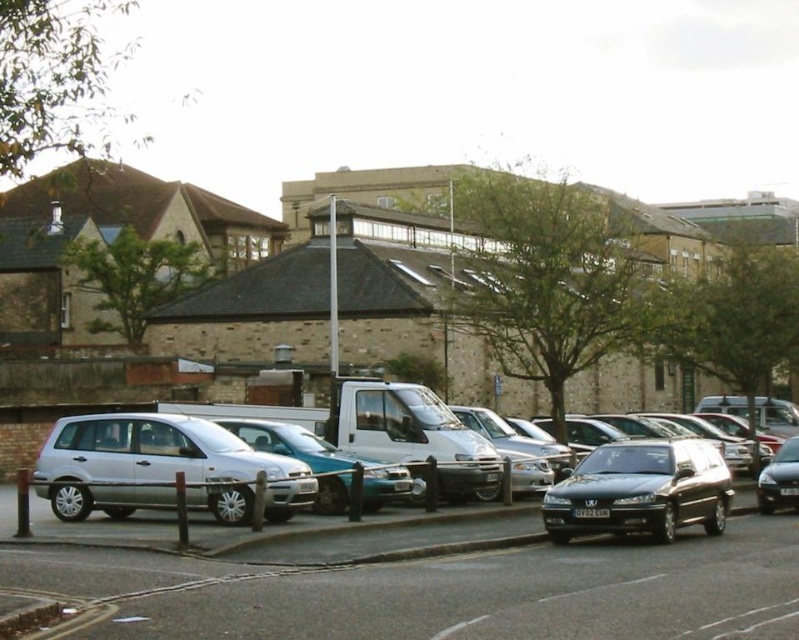
Is point (625, 458) in front of point (591, 512)?

No, (625, 458) is further to viewer.

Identify the location of shiny black car at center. (642, 490).

The height and width of the screenshot is (640, 799). What are the coordinates of `shiny black car at center` in the screenshot? It's located at (642, 490).

What are the coordinates of `silver metallic minivan at center` in the screenshot? It's located at (161, 467).

Is silver metallic minivan at center positioned at the back of shiny black car at center?

Yes, it is behind shiny black car at center.

Locate an element on the screen. silver metallic minivan at center is located at coordinates (161, 467).

You are a GUI agent. You are given a task and a screenshot of the screen. Output one action in this format:
    pyautogui.click(x=<x>, y=<y>)
    Task: Click on the silver metallic minivan at center
    
    Given the screenshot: What is the action you would take?
    pyautogui.click(x=161, y=467)

Which is behind, point (627, 525) or point (790, 481)?

Positioned behind is point (790, 481).

Which is below, shiny black car at center or shiny black sedan at right?

shiny black sedan at right is lower down.

Between point (680, 486) and point (778, 486), which one is positioned in front?

Positioned in front is point (680, 486).

This screenshot has height=640, width=799. I want to click on shiny black car at center, so click(x=642, y=490).